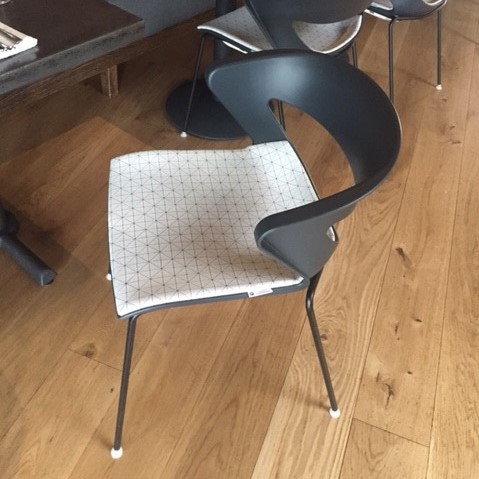
Where is `chair legs`? The width and height of the screenshot is (479, 479). chair legs is located at coordinates (126, 374), (320, 354), (110, 266), (190, 98), (280, 109), (353, 54), (390, 76), (438, 74).